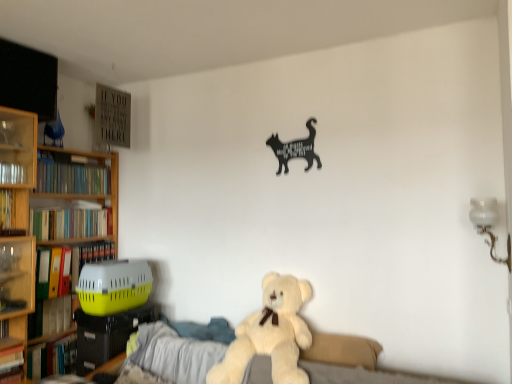
Question: Should I look upward or downward to see hardcover book at left, arranged as the 2th book when viewed from the top?

Choices:
 (A) up
 (B) down

Answer: (B)

Question: Can you confirm if wooden bookcase at left is thinner than yellow matte folder at left, positioned as the 4th book in top-to-bottom order?

Choices:
 (A) yes
 (B) no

Answer: (B)

Question: Does wooden bookcase at left contain yellow matte folder at left, positioned as the 4th book in top-to-bottom order?

Choices:
 (A) yes
 (B) no

Answer: (A)

Question: Considering the relative sizes of wooden bookcase at left and yellow matte folder at left, the 4th book in the bottom-to-top sequence, in the image provided, is wooden bookcase at left smaller than yellow matte folder at left, the 4th book in the bottom-to-top sequence,?

Choices:
 (A) yes
 (B) no

Answer: (B)

Question: From a real-world perspective, is wooden bookcase at left located beneath yellow matte folder at left, positioned as the 4th book in top-to-bottom order?

Choices:
 (A) no
 (B) yes

Answer: (A)

Question: From the image's perspective, is wooden bookcase at left over yellow matte folder at left, positioned as the 4th book in top-to-bottom order?

Choices:
 (A) no
 (B) yes

Answer: (B)

Question: From the image's perspective, would you say wooden bookcase at left is shown under yellow matte folder at left, the 4th book in the bottom-to-top sequence?

Choices:
 (A) yes
 (B) no

Answer: (B)

Question: Is green matte bookshelf at left, which is counted as the seventh book, starting from the bottom, in contact with wooden bookcase at left?

Choices:
 (A) no
 (B) yes

Answer: (A)

Question: Can you confirm if green matte bookshelf at left, which ranks as the first book in top-to-bottom order, is thinner than wooden bookcase at left?

Choices:
 (A) no
 (B) yes

Answer: (B)

Question: Considering the relative sizes of green matte bookshelf at left, which ranks as the first book in top-to-bottom order, and wooden bookcase at left in the image provided, is green matte bookshelf at left, which ranks as the first book in top-to-bottom order, wider than wooden bookcase at left?

Choices:
 (A) yes
 (B) no

Answer: (B)

Question: Can you confirm if green matte bookshelf at left, which ranks as the first book in top-to-bottom order, is shorter than wooden bookcase at left?

Choices:
 (A) no
 (B) yes

Answer: (B)

Question: Can you confirm if green matte bookshelf at left, which ranks as the first book in top-to-bottom order, is bigger than wooden bookcase at left?

Choices:
 (A) yes
 (B) no

Answer: (B)

Question: Is the depth of green matte bookshelf at left, which ranks as the first book in top-to-bottom order, greater than that of wooden bookcase at left?

Choices:
 (A) no
 (B) yes

Answer: (B)

Question: Can you confirm if hardcover books at left, the fifth book positioned from the bottom, is wider than hardcover book at left, placed as the 6th book when sorted from bottom to top?

Choices:
 (A) yes
 (B) no

Answer: (B)